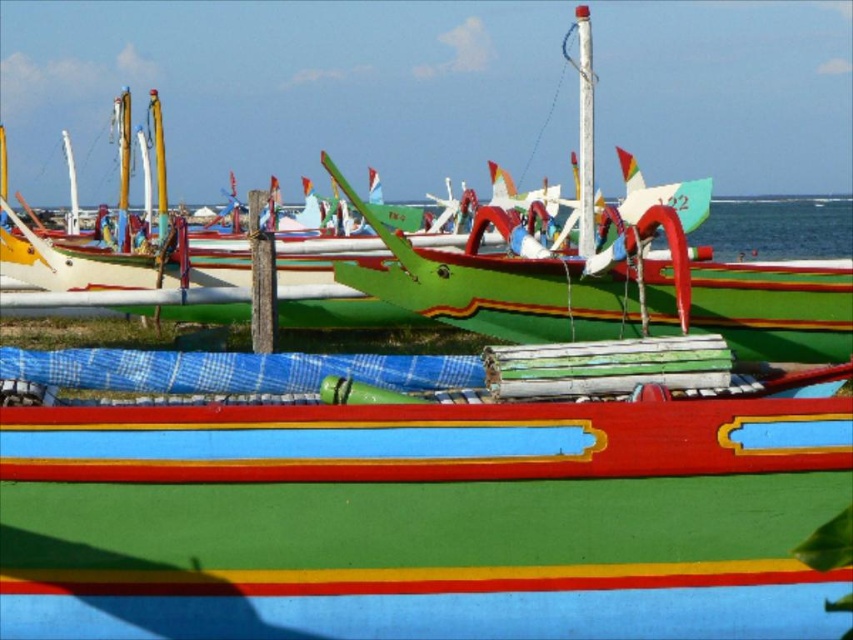
How much distance is there between green painted wood boat at center and smooth plastic line at lower center?

They are 5.34 meters apart.

Can you confirm if green painted wood boat at center is wider than smooth plastic line at lower center?

Yes, green painted wood boat at center is wider than smooth plastic line at lower center.

Between point (511, 320) and point (431, 577), which one is positioned in front?

Point (431, 577) is in front.

You are a GUI agent. You are given a task and a screenshot of the screen. Output one action in this format:
    pyautogui.click(x=<x>, y=<y>)
    Task: Click on the green painted wood boat at center
    The image size is (853, 640).
    Given the screenshot: What is the action you would take?
    pyautogui.click(x=608, y=289)